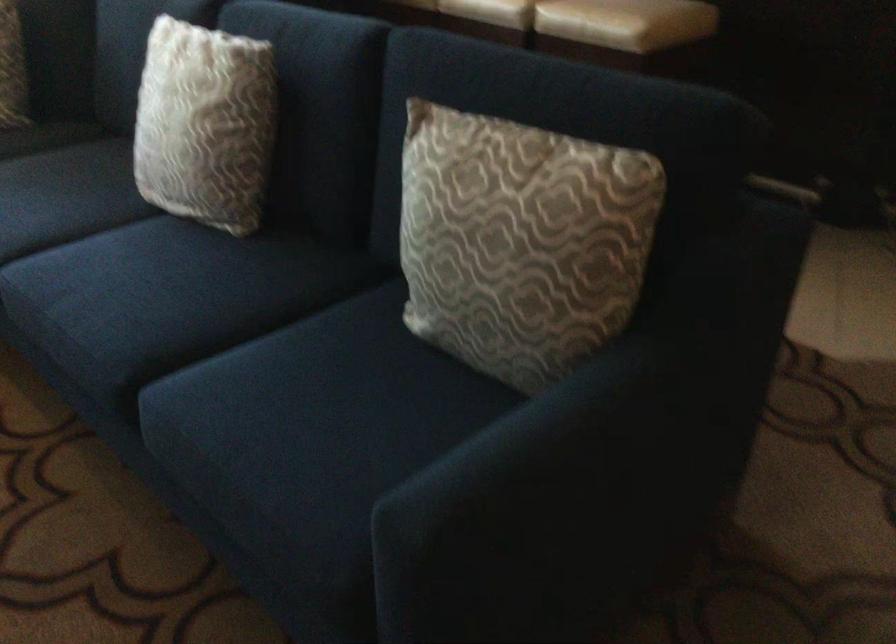
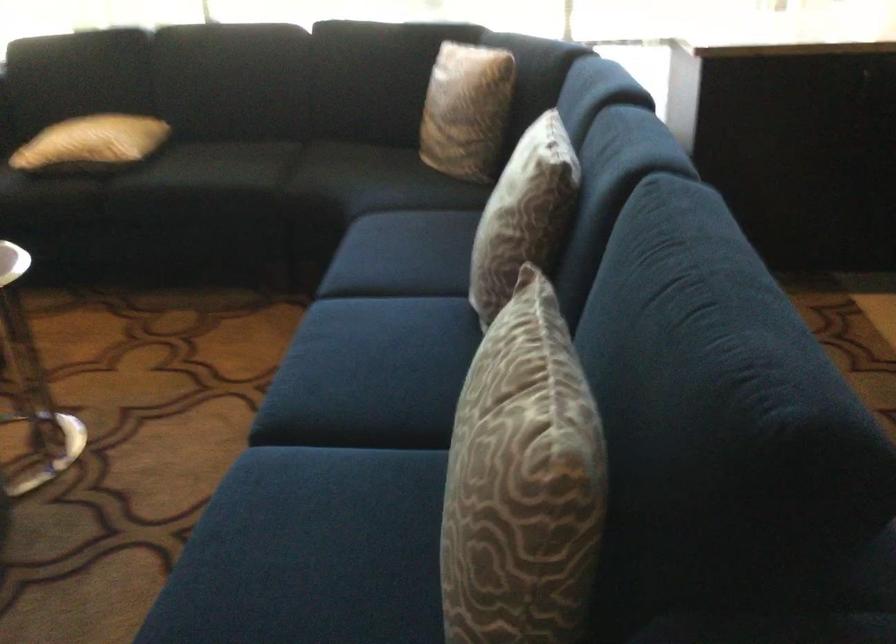
Locate, in the second image, the point that corresponds to (x=233, y=106) in the first image.

(523, 213)